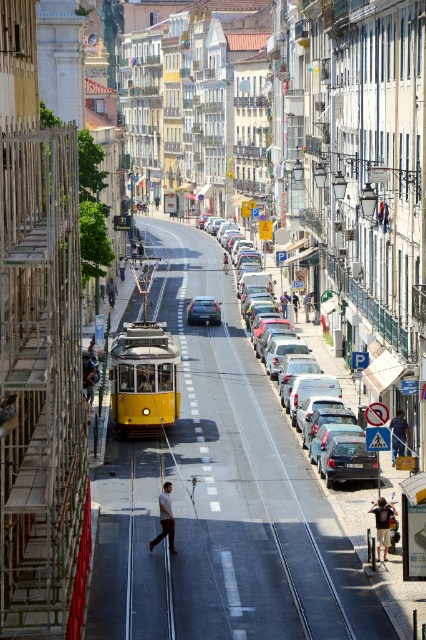
Based on the photo, you are standing on the street looking at the yellow tram and the buildings. There are two points marked on the image at coordinates point (394, 438) and point (222, 257). Which point is closer to you?

Point (394, 438) is closer to the camera than point (222, 257).